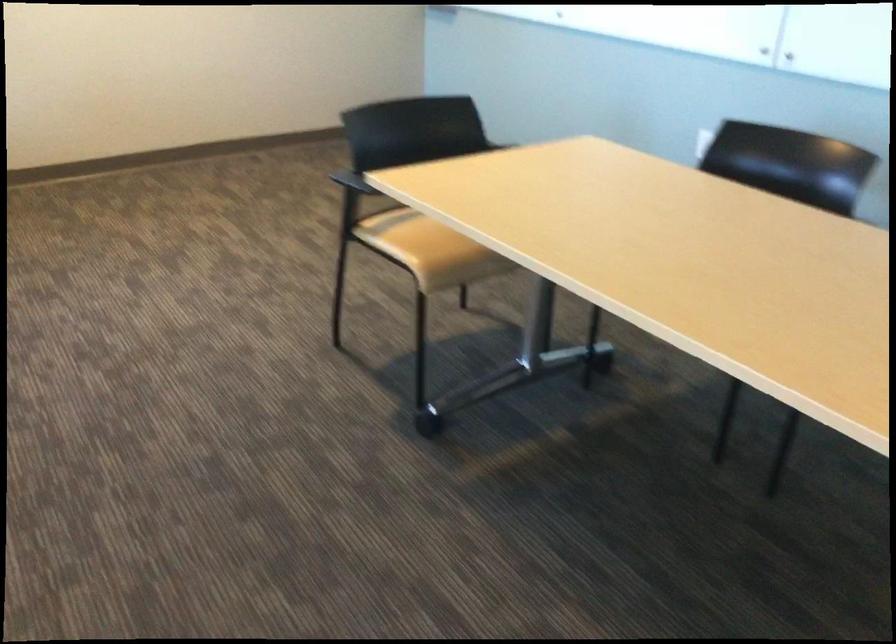
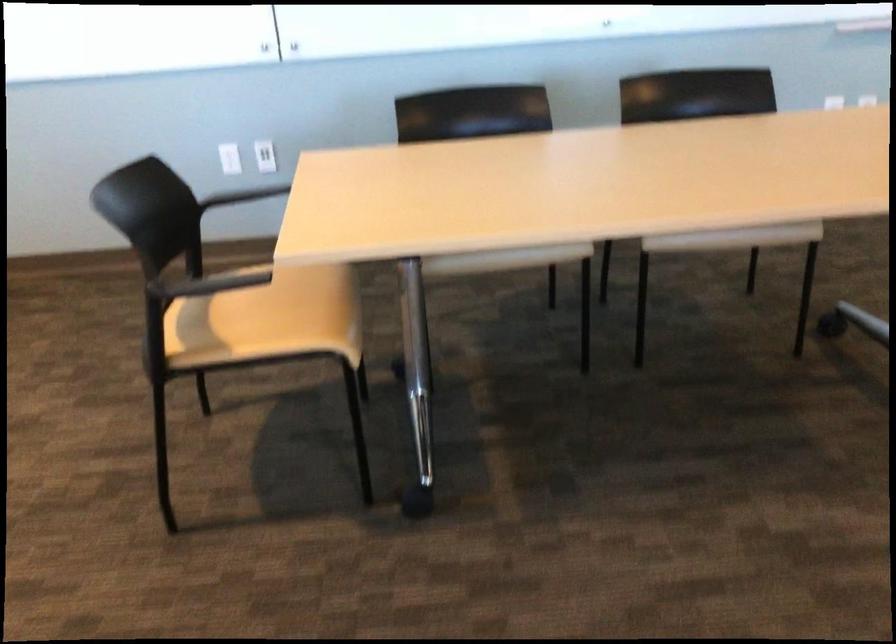
Where in the second image is the point corresponding to pixel 421 242 from the first image?

(274, 315)